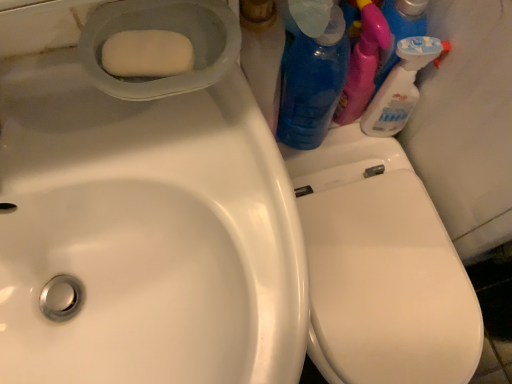
Question: Looking at the image, does blue translucent bottle at upper right, marked as the 1th cleaning product in a left-to-right arrangement, seem bigger or smaller compared to white glossy spray bottle at upper right, which is counted as the 1th cleaning product, starting from the right?

Choices:
 (A) big
 (B) small

Answer: (A)

Question: Considering their positions, is blue translucent bottle at upper right, acting as the second cleaning product starting from the right, located in front of or behind white glossy spray bottle at upper right, acting as the second cleaning product starting from the left?

Choices:
 (A) behind
 (B) front

Answer: (B)

Question: Which object is the farthest from the white glossy sink at upper left?

Choices:
 (A) blue translucent bottle at upper right, acting as the second cleaning product starting from the right
 (B) white glossy spray bottle at upper right, acting as the second cleaning product starting from the left
 (C) white matte soap at upper left

Answer: (B)

Question: Based on their relative distances, which object is farther from the white matte soap at upper left?

Choices:
 (A) white glossy spray bottle at upper right, which is counted as the 1th cleaning product, starting from the right
 (B) white glossy sink at upper left
 (C) blue translucent bottle at upper right, acting as the second cleaning product starting from the right

Answer: (A)